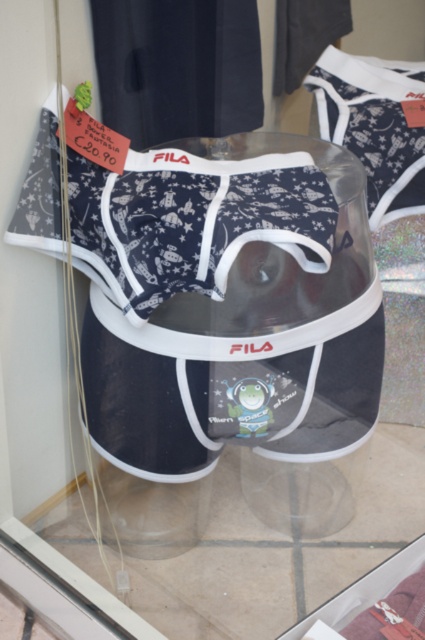
You are a customer looking at the store window display. You see the navy blue cotton boxer shorts at center and the transparent plastic at center. Which item is closer to you?

The navy blue cotton boxer shorts at center is closer to you because it is in front of the transparent plastic at center.

You are a customer looking at the store window display. You see the navy blue cotton boxer shorts at center and the transparent plastic at center. Which item is positioned to the left?

The navy blue cotton boxer shorts at center is to the left of the transparent plastic at center.